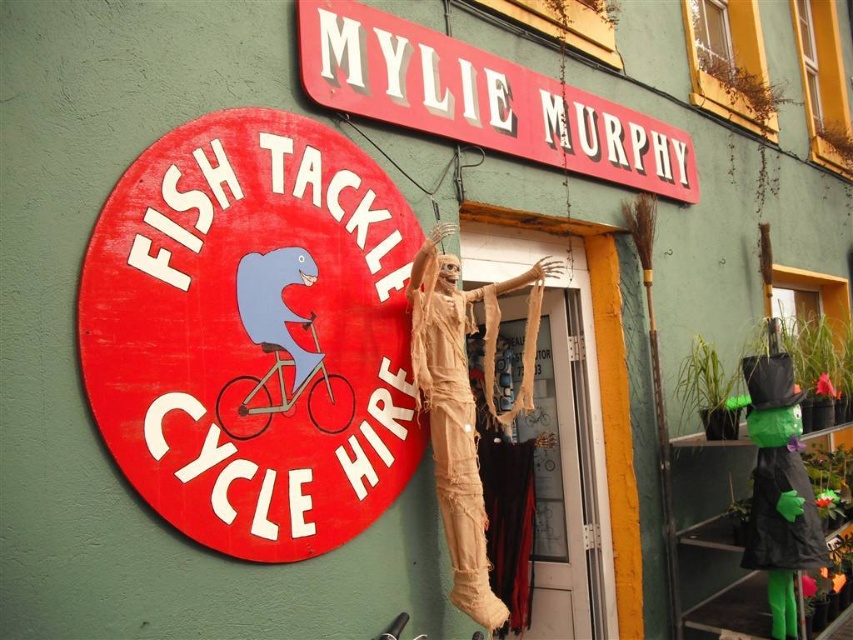
Does red plastic sign at upper center have a greater height compared to beige fabric mummy at center?

Incorrect, red plastic sign at upper center's height is not larger of beige fabric mummy at center's.

Who is more distant from viewer, (320, 17) or (502, 282)?

Point (502, 282)

Consider the image. Who is more forward, [606,112] or [454,556]?

Positioned in front is point [454,556].

What are the coordinates of `red plastic sign at upper center` in the screenshot? It's located at (480, 99).

In the scene shown: Is wooden fish tackle cycle hire sign at left bigger than red plastic sign at upper center?

Actually, wooden fish tackle cycle hire sign at left might be smaller than red plastic sign at upper center.

Is wooden fish tackle cycle hire sign at left smaller than red plastic sign at upper center?

Correct, wooden fish tackle cycle hire sign at left occupies less space than red plastic sign at upper center.

The width and height of the screenshot is (853, 640). Describe the element at coordinates (253, 333) in the screenshot. I see `wooden fish tackle cycle hire sign at left` at that location.

Where is `wooden fish tackle cycle hire sign at left`? wooden fish tackle cycle hire sign at left is located at coordinates (253, 333).

Is point (233, 131) behind point (462, 552)?

No, (233, 131) is in front of (462, 552).

Can you confirm if wooden fish tackle cycle hire sign at left is smaller than beige fabric mummy at center?

Actually, wooden fish tackle cycle hire sign at left might be larger than beige fabric mummy at center.

Who is more forward, (366, 182) or (483, 595)?

Point (483, 595)

Where is `wooden fish tackle cycle hire sign at left`? wooden fish tackle cycle hire sign at left is located at coordinates (253, 333).